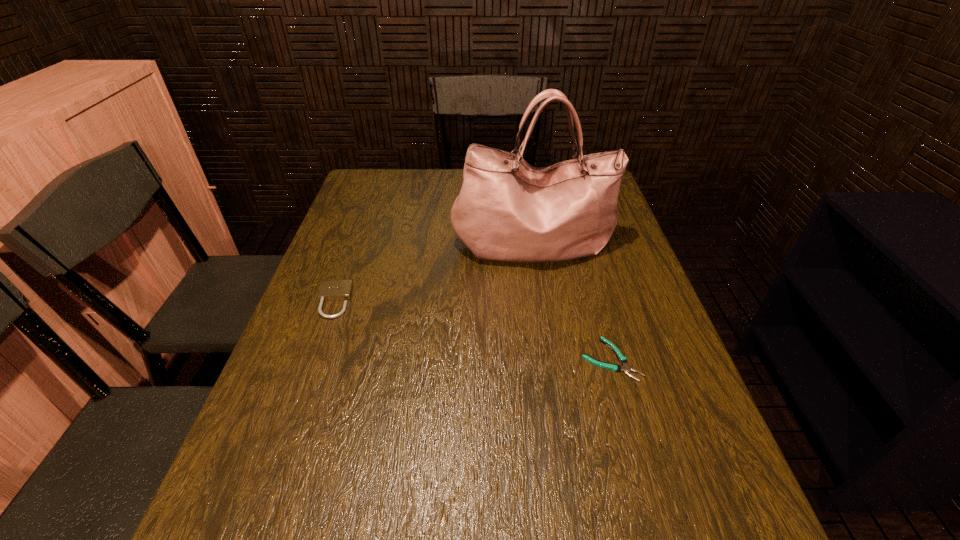
You are a GUI agent. You are given a task and a screenshot of the screen. Output one action in this format:
    pyautogui.click(x=<x>, y=<y>)
    Task: Click on the free area in between the second tallest object and the tallest object
    
    Given the screenshot: What is the action you would take?
    pyautogui.click(x=434, y=273)

The height and width of the screenshot is (540, 960). In order to click on vacant space in between the second farthest object and the pliers in this screenshot , I will do `click(472, 330)`.

I want to click on free spot between the padlock and the handbag, so click(x=434, y=273).

You are a GUI agent. You are given a task and a screenshot of the screen. Output one action in this format:
    pyautogui.click(x=<x>, y=<y>)
    Task: Click on the vacant space that's between the nearest object and the farthest object
    
    Given the screenshot: What is the action you would take?
    pyautogui.click(x=572, y=301)

The image size is (960, 540). Find the location of `vacant space that's between the second shortest object and the farthest object`. vacant space that's between the second shortest object and the farthest object is located at coordinates (434, 273).

You are a GUI agent. You are given a task and a screenshot of the screen. Output one action in this format:
    pyautogui.click(x=<x>, y=<y>)
    Task: Click on the free point between the padlock and the nearest object
    
    Given the screenshot: What is the action you would take?
    pyautogui.click(x=472, y=330)

Locate which object ranks in proximity to the handbag. Please provide its 2D coordinates. Your answer should be formatted as a tuple, i.e. [(x, y)], where the tuple contains the x and y coordinates of a point satisfying the conditions above.

[(626, 368)]

Find the location of a particular element. object that is the closest to the farthest object is located at coordinates (626, 368).

Locate an element on the screen. vacant area in the image that satisfies the following two spatial constraints: 1. at the front of the nearest object with handles; 2. on the right side of the handbag is located at coordinates (552, 359).

This screenshot has height=540, width=960. What are the coordinates of `vacant space that satisfies the following two spatial constraints: 1. on the front side of the second tallest object; 2. on the right side of the shortest object` in the screenshot? It's located at (313, 359).